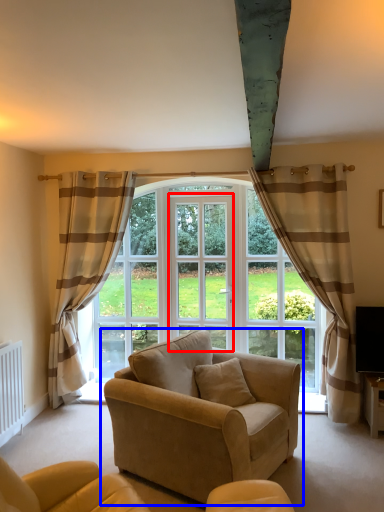
Question: Which object appears farthest to the camera in this image, screen door (highlighted by a red box) or studio couch (highlighted by a blue box)?

Choices:
 (A) screen door
 (B) studio couch

Answer: (A)